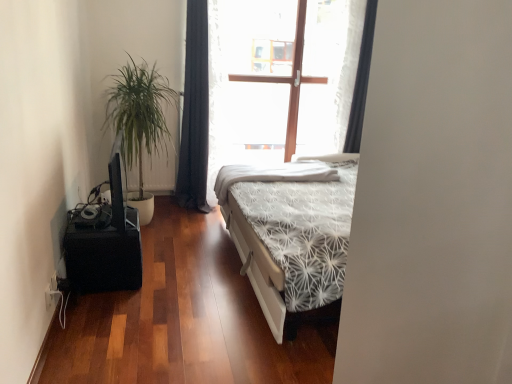
Question: Does black matte speaker at lower left have a lesser width compared to black fabric curtain at upper right, marked as the first curtain in a right-to-left arrangement?

Choices:
 (A) yes
 (B) no

Answer: (B)

Question: Does black matte speaker at lower left have a greater width compared to black fabric curtain at upper right, marked as the first curtain in a right-to-left arrangement?

Choices:
 (A) no
 (B) yes

Answer: (B)

Question: From the image's perspective, is black matte speaker at lower left under black fabric curtain at upper right, marked as the first curtain in a right-to-left arrangement?

Choices:
 (A) yes
 (B) no

Answer: (A)

Question: Can you confirm if black matte speaker at lower left is shorter than black fabric curtain at upper right, marked as the first curtain in a right-to-left arrangement?

Choices:
 (A) yes
 (B) no

Answer: (A)

Question: Is black matte speaker at lower left further to camera compared to black fabric curtain at upper right, the second curtain viewed from the left?

Choices:
 (A) no
 (B) yes

Answer: (A)

Question: Do you think white textured bedsheet at center is within black fabric curtain at center, the 1th curtain from the left, or outside of it?

Choices:
 (A) inside
 (B) outside

Answer: (B)

Question: From the image's perspective, relative to black fabric curtain at center, the 1th curtain from the left, is white textured bedsheet at center above or below?

Choices:
 (A) above
 (B) below

Answer: (B)

Question: In terms of height, does white textured bedsheet at center look taller or shorter compared to black fabric curtain at center, the 1th curtain from the left?

Choices:
 (A) tall
 (B) short

Answer: (B)

Question: In the image, is white textured bedsheet at center positioned in front of or behind black fabric curtain at center, the 1th curtain from the left?

Choices:
 (A) front
 (B) behind

Answer: (A)

Question: In the image, is green leafy plant at left on the left side or the right side of white textured bedsheet at center?

Choices:
 (A) left
 (B) right

Answer: (A)

Question: Is green leafy plant at left bigger or smaller than white textured bedsheet at center?

Choices:
 (A) small
 (B) big

Answer: (B)

Question: Does point (137, 115) appear closer or farther from the camera than point (269, 175)?

Choices:
 (A) farther
 (B) closer

Answer: (B)

Question: From the image's perspective, is green leafy plant at left above or below white textured bedsheet at center?

Choices:
 (A) above
 (B) below

Answer: (A)

Question: Relative to white textured bedsheet at center, is black matte speaker at lower left in front or behind?

Choices:
 (A) front
 (B) behind

Answer: (A)

Question: In the image, is black matte speaker at lower left on the left side or the right side of white textured bedsheet at center?

Choices:
 (A) left
 (B) right

Answer: (A)